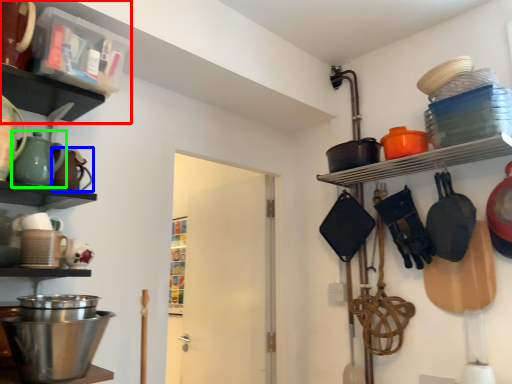
Question: Which is nearer to the shelf (highlighted by a red box)? tea pot (highlighted by a blue box) or tea pot (highlighted by a green box).

Choices:
 (A) tea pot
 (B) tea pot

Answer: (B)